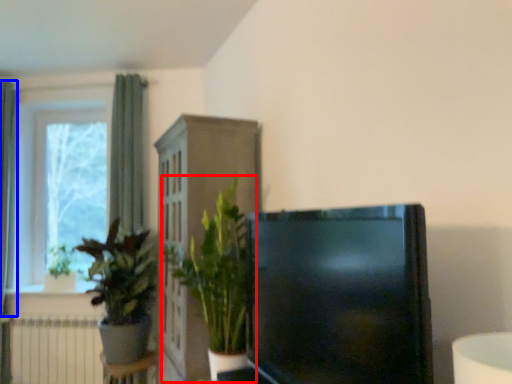
Question: Which point is further to the camera, houseplant (highlighted by a red box) or curtain (highlighted by a blue box)?

Choices:
 (A) houseplant
 (B) curtain

Answer: (B)